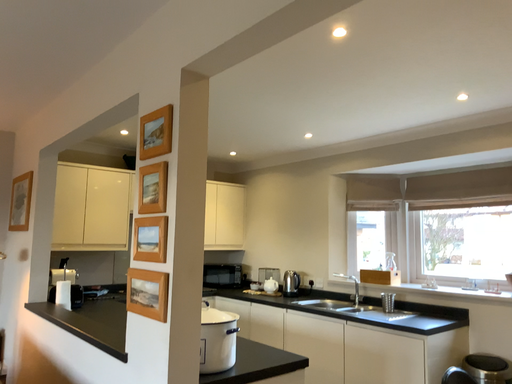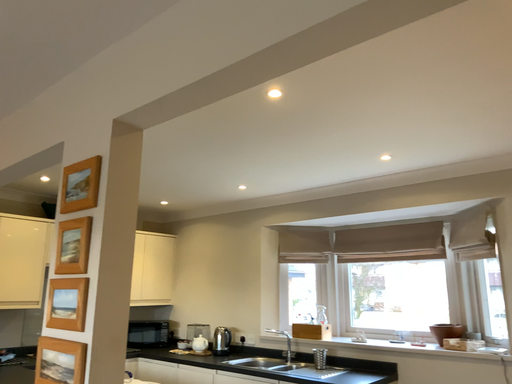
Question: Which way did the camera rotate in the video?

Choices:
 (A) rotated upward
 (B) rotated downward

Answer: (A)